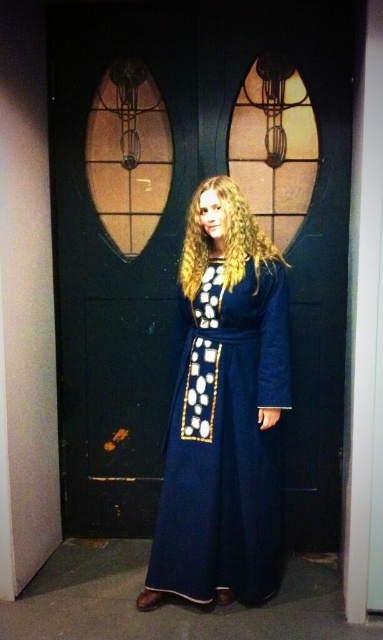
Who is positioned more to the right, dark wood door at center or golden curly hair at center?

From the viewer's perspective, golden curly hair at center appears more on the right side.

Can you confirm if dark wood door at center is wider than golden curly hair at center?

Indeed, dark wood door at center has a greater width compared to golden curly hair at center.

Locate an element on the screen. The width and height of the screenshot is (383, 640). dark wood door at center is located at coordinates (181, 246).

Is velvet blue robe at center closer to camera compared to golden curly hair at center?

Yes.

Is velvet blue robe at center above golden curly hair at center?

Actually, velvet blue robe at center is below golden curly hair at center.

The height and width of the screenshot is (640, 383). What do you see at coordinates (224, 412) in the screenshot?
I see `velvet blue robe at center` at bounding box center [224, 412].

This screenshot has width=383, height=640. Find the location of `velvet blue robe at center`. velvet blue robe at center is located at coordinates (224, 412).

Is dark wood door at center shorter than velvet blue robe at center?

No.

Is point (50, 4) positioned before point (227, 513)?

That is False.

Identify the location of dark wood door at center. This screenshot has height=640, width=383. (181, 246).